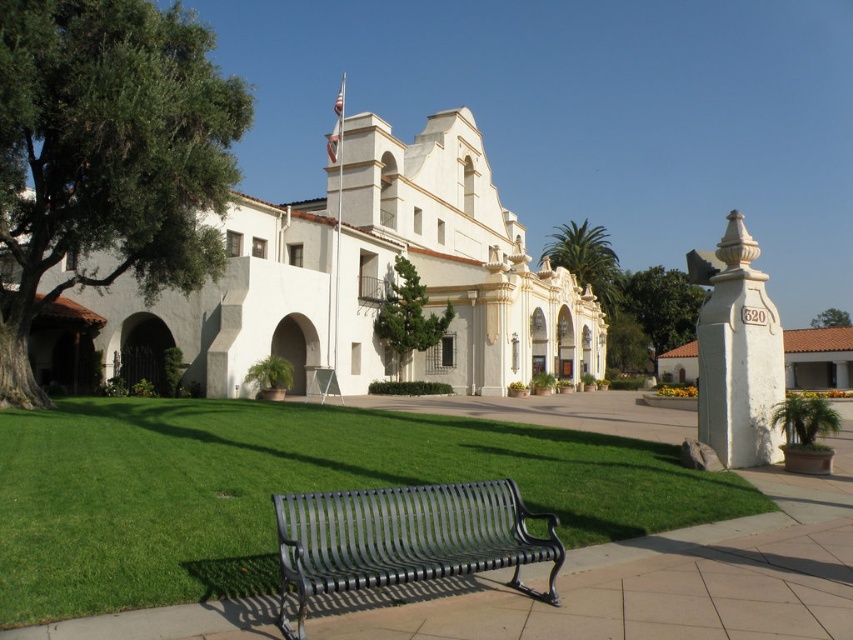
Question: Is green leafy tree at left positioned in front of white stone column at right?

Choices:
 (A) yes
 (B) no

Answer: (B)

Question: Which is nearer to the white stucco church at center?

Choices:
 (A) green leafy tree at center
 (B) green leafy tree at left
 (C) green grass at center

Answer: (B)

Question: Which object is closer to the camera taking this photo?

Choices:
 (A) green leafy palm at center
 (B) green leafy tree at left

Answer: (B)

Question: Can you confirm if green leafy palm at center is wider than green leafy tree at upper right?

Choices:
 (A) yes
 (B) no

Answer: (A)

Question: Among these objects, which one is nearest to the camera?

Choices:
 (A) white stone column at right
 (B) green textured tree at center
 (C) green leafy palm at center
 (D) metallic black bench at lower center

Answer: (D)

Question: Does white stucco church at center have a larger size compared to green leafy tree at center?

Choices:
 (A) no
 (B) yes

Answer: (A)